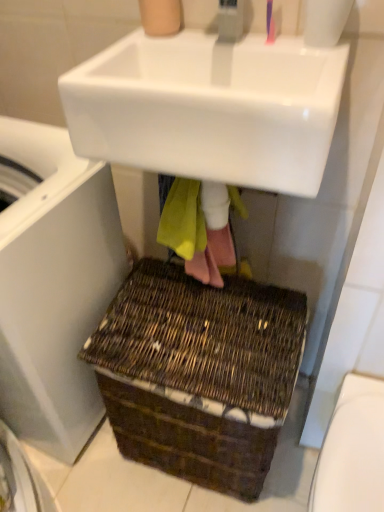
Identify the location of free spot above white glossy toilet bowl at lower right (from a real-world perspective). The image size is (384, 512). (361, 441).